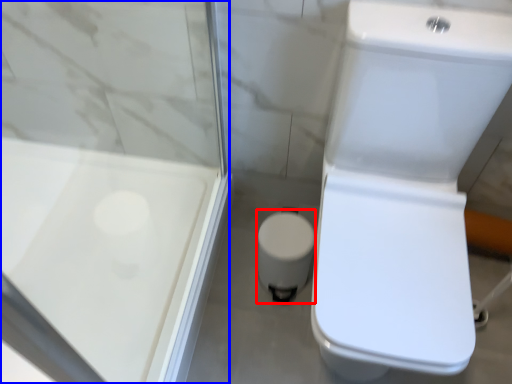
Question: Which of the following is the farthest to the observer, porcelain (highlighted by a red box) or screen door (highlighted by a blue box)?

Choices:
 (A) porcelain
 (B) screen door

Answer: (A)